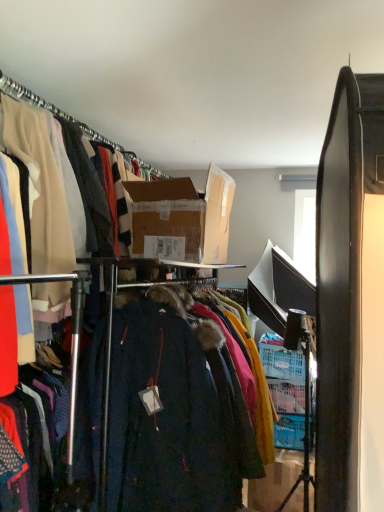
Question: From the image's perspective, is brown cardboard box at center, which ranks as the 2th box in right-to-left order, above or below velvet dark coat at center?

Choices:
 (A) above
 (B) below

Answer: (A)

Question: From their relative heights in the image, would you say brown cardboard box at center, which ranks as the 2th box in right-to-left order, is taller or shorter than velvet dark coat at center?

Choices:
 (A) short
 (B) tall

Answer: (A)

Question: Estimate the real-world distances between objects in this image. Which object is closer to the cardboard box at center, which ranks as the 1th box in bottom-to-top order?

Choices:
 (A) velvet dark coat at center
 (B) matte plastic hanger at upper left
 (C) brown cardboard box at center, placed as the 1th box when sorted from top to bottom

Answer: (A)

Question: Which of these objects is positioned closest to the brown cardboard box at center, which is the first box from left to right?

Choices:
 (A) velvet dark coat at center
 (B) cardboard box at center, which ranks as the 1th box in bottom-to-top order
 (C) matte plastic hanger at upper left

Answer: (C)